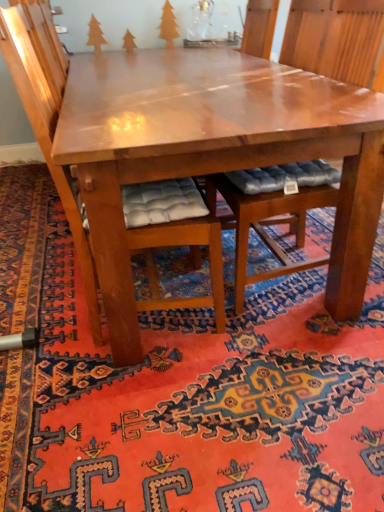
Question: Is orange matte tree at upper center, positioned as the third tree in left-to-right order, spatially inside carpet with intricate patterns at center, or outside of it?

Choices:
 (A) inside
 (B) outside

Answer: (B)

Question: From the image's perspective, is orange matte tree at upper center, arranged as the first tree when viewed from the right, located above or below carpet with intricate patterns at center?

Choices:
 (A) below
 (B) above

Answer: (B)

Question: Which object is the closest to the wooden tree at upper left, the third tree when ordered from right to left?

Choices:
 (A) carpet with intricate patterns at center
 (B) orange matte tree at upper center, arranged as the first tree when viewed from the right
 (C) shiny brown table at center
 (D) wooden cushioned chair at center, which appears as the 2th chair when viewed from the left
 (E) matte brown tree at upper center, the 2th tree from the right

Answer: (E)

Question: Estimate the real-world distances between objects in this image. Which object is closer to the wooden cushioned chair at center, the first chair in the left-to-right sequence?

Choices:
 (A) carpet with intricate patterns at center
 (B) matte brown tree at upper center, the 2th tree from the right
 (C) orange matte tree at upper center, arranged as the first tree when viewed from the right
 (D) wooden cushioned chair at center, which appears as the 2th chair when viewed from the left
 (E) shiny brown table at center

Answer: (E)